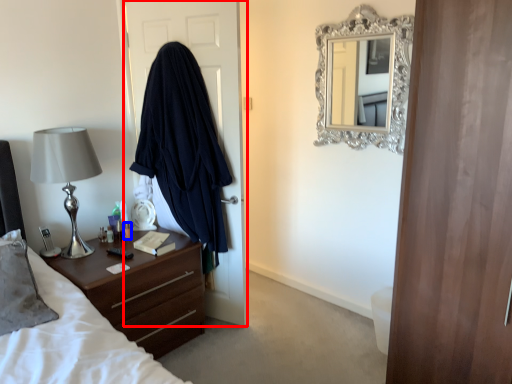
Question: Which of the following is the closest to the observer, door (highlighted by a red box) or bottle (highlighted by a blue box)?

Choices:
 (A) door
 (B) bottle

Answer: (A)